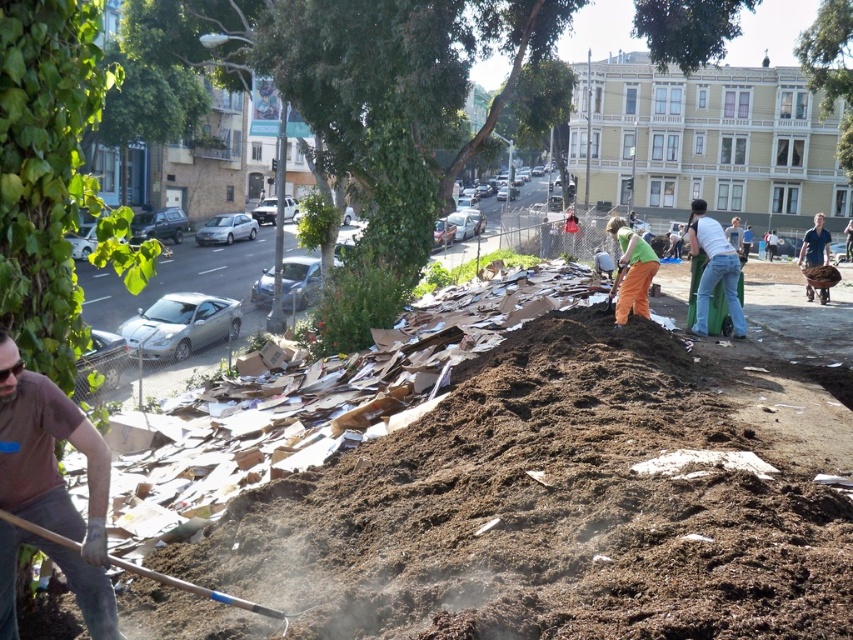
Question: Does wooden handle shovel at lower left appear on the left side of denim jeans at center right?

Choices:
 (A) no
 (B) yes

Answer: (B)

Question: Does brown leather gloves at lower left have a lesser width compared to green fabric shirt at center?

Choices:
 (A) yes
 (B) no

Answer: (A)

Question: From the image, what is the correct spatial relationship of green fabric shirt at center in relation to denim jeans at center right?

Choices:
 (A) below
 (B) above

Answer: (A)

Question: Which of the following is the closest to the observer?

Choices:
 (A) wooden handle shovel at lower left
 (B) green fabric shirt at center
 (C) denim jeans at center right
 (D) brown leather gloves at lower left

Answer: (D)

Question: Which of the following is the farthest from the observer?

Choices:
 (A) denim jeans at center right
 (B) wooden handle shovel at lower left
 (C) brown leather gloves at lower left
 (D) green denim jeans at center

Answer: (A)

Question: Which of the following is the farthest from the observer?

Choices:
 (A) [149, 570]
 (B) [804, 252]
 (C) [616, 241]

Answer: (C)